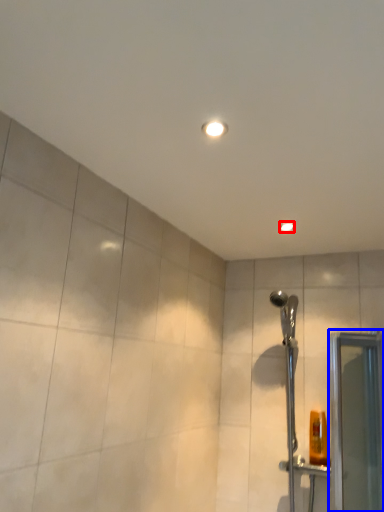
Question: Which object appears farthest to the camera in this image, light fixture (highlighted by a red box) or screen door (highlighted by a blue box)?

Choices:
 (A) light fixture
 (B) screen door

Answer: (A)